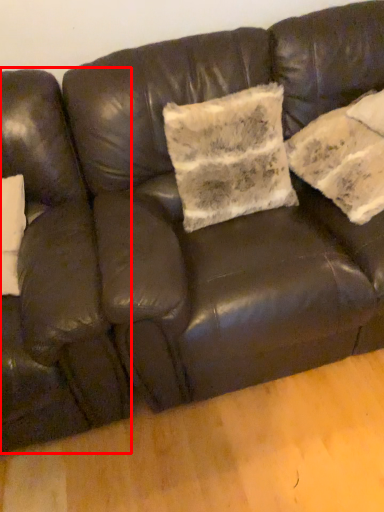
Question: From the image's perspective, where is armchair (annotated by the red box) located in relation to pillow in the image?

Choices:
 (A) above
 (B) below

Answer: (B)